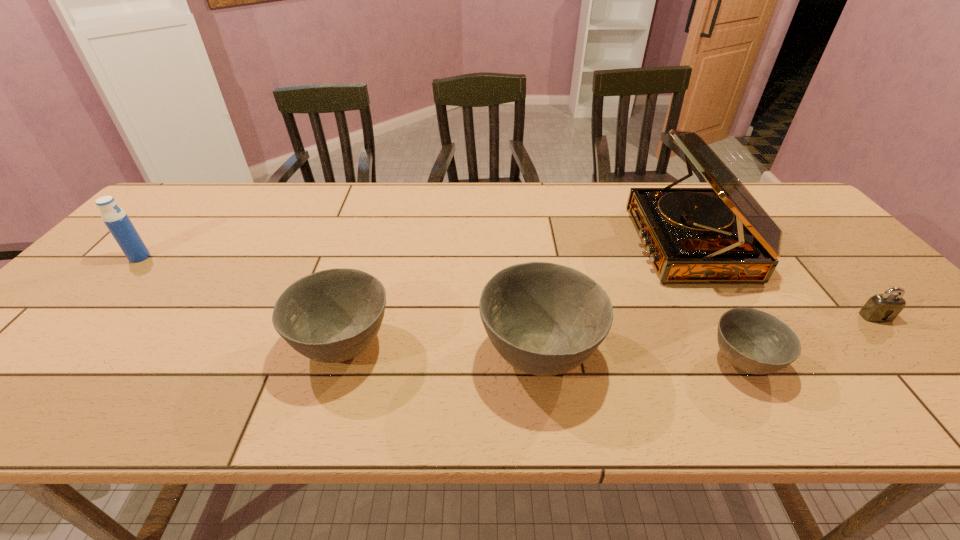
Please point a spot to add another bowl on the right. Please provide its 2D coordinates. Your answer should be formatted as a tuple, i.e. [(x, y)], where the tuple contains the x and y coordinates of a point satisfying the conditions above.

[(954, 370)]